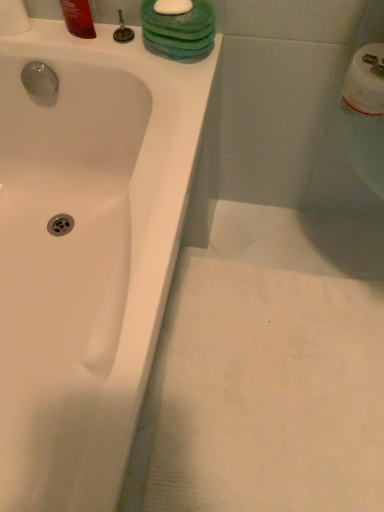
Question: From the image's perspective, is white glossy bathtub at upper left beneath matte silver faucet at upper center?

Choices:
 (A) yes
 (B) no

Answer: (A)

Question: Does white glossy bathtub at upper left have a lesser width compared to matte silver faucet at upper center?

Choices:
 (A) no
 (B) yes

Answer: (A)

Question: Can you confirm if white glossy bathtub at upper left is smaller than matte silver faucet at upper center?

Choices:
 (A) no
 (B) yes

Answer: (A)

Question: Can you confirm if white glossy bathtub at upper left is taller than matte silver faucet at upper center?

Choices:
 (A) no
 (B) yes

Answer: (B)

Question: Is white glossy bathtub at upper left not inside matte silver faucet at upper center?

Choices:
 (A) no
 (B) yes

Answer: (B)

Question: From the image's perspective, does white glossy bathtub at upper left appear higher than matte silver faucet at upper center?

Choices:
 (A) no
 (B) yes

Answer: (A)

Question: Is white glossy bathtub at upper left oriented towards white paper towel at upper left?

Choices:
 (A) no
 (B) yes

Answer: (A)

Question: Considering the relative sizes of white glossy bathtub at upper left and white paper towel at upper left in the image provided, is white glossy bathtub at upper left shorter than white paper towel at upper left?

Choices:
 (A) yes
 (B) no

Answer: (B)

Question: Can white paper towel at upper left be found inside white glossy bathtub at upper left?

Choices:
 (A) yes
 (B) no

Answer: (B)

Question: Is white glossy bathtub at upper left positioned with its back to white paper towel at upper left?

Choices:
 (A) no
 (B) yes

Answer: (A)

Question: Is white glossy bathtub at upper left closer to camera compared to white paper towel at upper left?

Choices:
 (A) no
 (B) yes

Answer: (B)

Question: From a real-world perspective, is white glossy bathtub at upper left physically above white paper towel at upper left?

Choices:
 (A) no
 (B) yes

Answer: (A)

Question: From the image's perspective, is white glossy bathtub at upper left located above shiny plastic bottle at upper left?

Choices:
 (A) yes
 (B) no

Answer: (B)